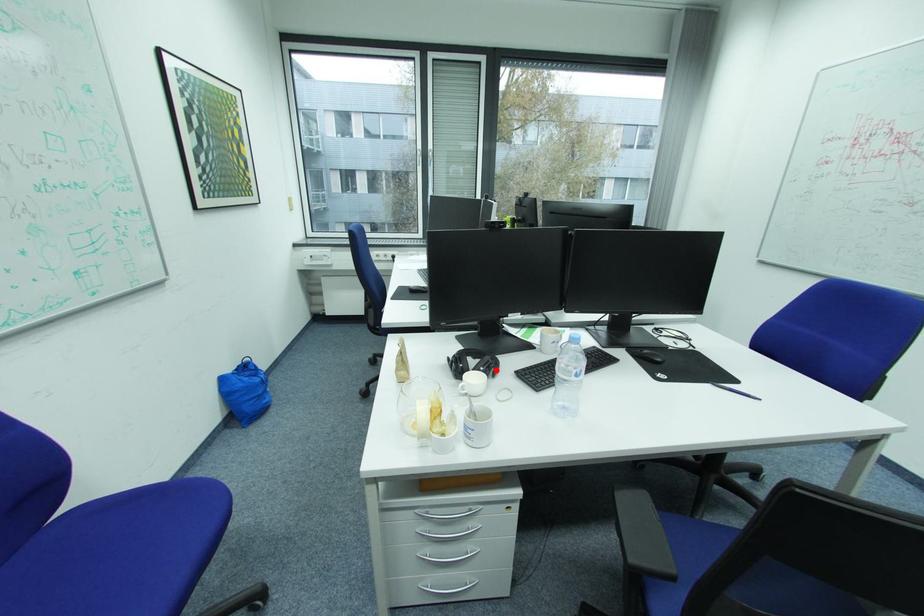
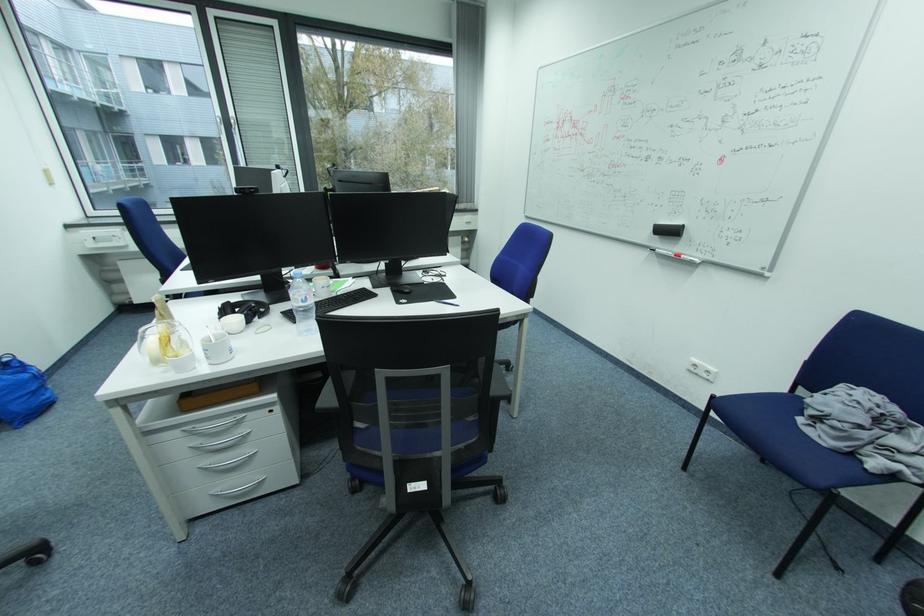
Locate, in the second image, the point that corresponds to the highlighted location in the first image.

(259, 313)